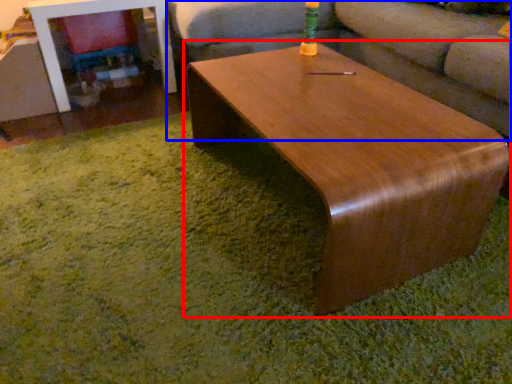
Question: Among these objects, which one is nearest to the camera, coffee table (highlighted by a red box) or studio couch (highlighted by a blue box)?

Choices:
 (A) coffee table
 (B) studio couch

Answer: (A)